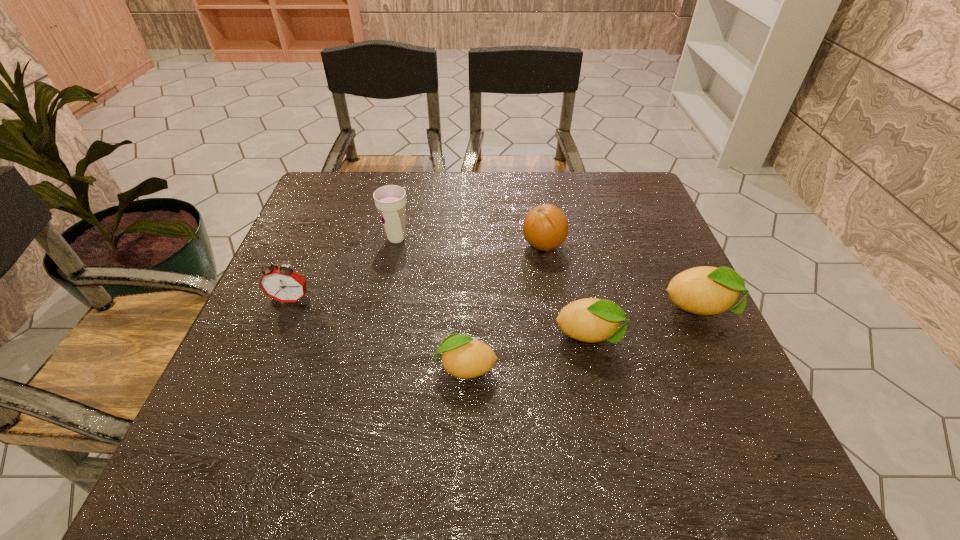
Considering the uniform spacing of lemons, where should an additional lemon be positioned on the left? Please locate a free spot. Please provide its 2D coordinates. Your answer should be formatted as a tuple, i.e. [(x, y)], where the tuple contains the x and y coordinates of a point satisfying the conditions above.

[(324, 402)]